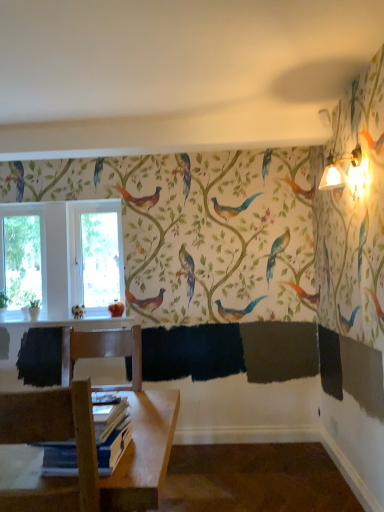
Question: Is point (72, 314) positioned closer to the camera than point (23, 226)?

Choices:
 (A) farther
 (B) closer

Answer: (B)

Question: In terms of width, does matte white bird at lower left look wider or thinner when compared to transparent glass window at left, marked as the 2th window screen in a right-to-left arrangement?

Choices:
 (A) wide
 (B) thin

Answer: (B)

Question: Which of these objects is positioned farthest from the transparent glass window at center, the second window screen positioned from the left?

Choices:
 (A) wooden chair at lower left
 (B) blue paper book at lower left
 (C) matte white bird at lower left
 (D) transparent glass window at left, positioned as the first window screen in left-to-right order
 (E) matte gold sconce at upper right

Answer: (A)

Question: Considering the real-world distances, which object is farthest from the transparent glass window at left, marked as the 2th window screen in a right-to-left arrangement?

Choices:
 (A) matte white bird at lower left
 (B) matte gold sconce at upper right
 (C) wooden chair at lower left
 (D) transparent glass window at center, the first window screen from the right
 (E) blue paper book at lower left

Answer: (C)